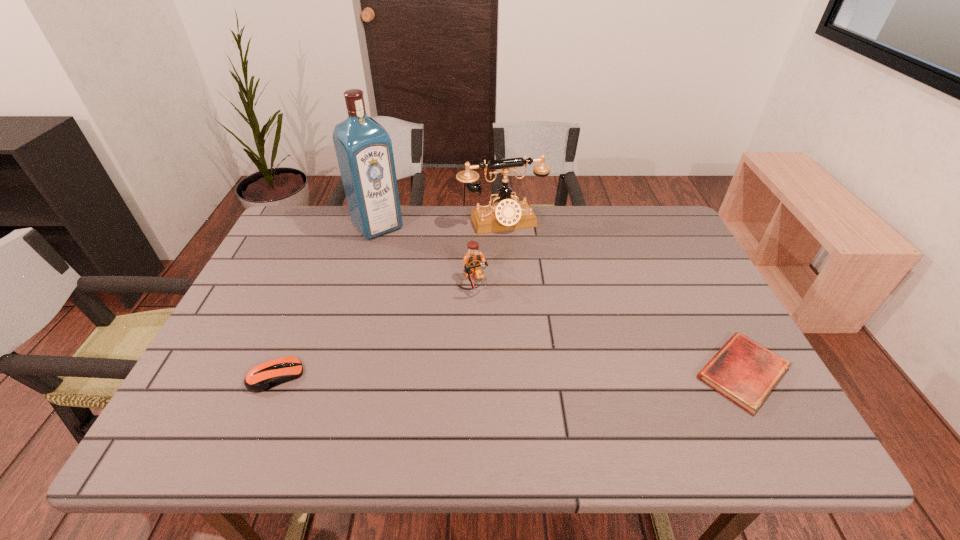
Image resolution: width=960 pixels, height=540 pixels. In order to click on vacant space on the desktop that is between the fourth tallest object and the rightmost object and is positioned on the flat label side of the tallest object in this screenshot , I will do `click(506, 374)`.

Image resolution: width=960 pixels, height=540 pixels. I want to click on vacant spot on the desktop that is between the fourth tallest object and the shortest object and is positioned holding a crossbow in the hands of the third tallest object, so click(x=528, y=374).

The image size is (960, 540). In order to click on vacant space on the desktop that is between the second shortest object and the shortest object and is positioned on the dial of the telephone in this screenshot , I will do `click(570, 374)`.